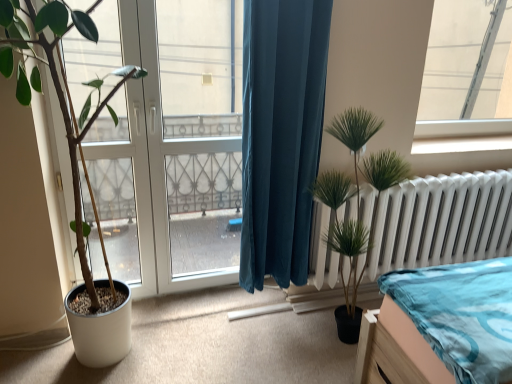
Find the location of `vacant space in green matte plant at left, positioned as the 2th houseplant in right-to-left order (from a real-world perspective)`. vacant space in green matte plant at left, positioned as the 2th houseplant in right-to-left order (from a real-world perspective) is located at coordinates (102, 365).